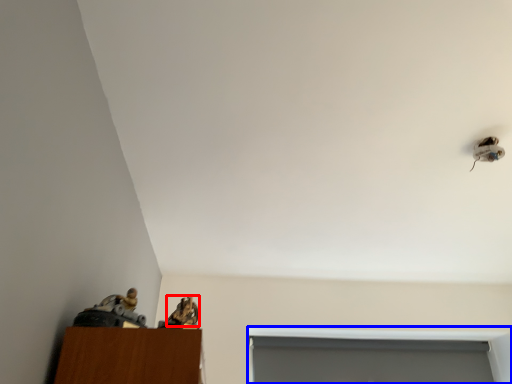
Question: Which point is further to the camera, animal (highlighted by a red box) or window (highlighted by a blue box)?

Choices:
 (A) animal
 (B) window

Answer: (B)